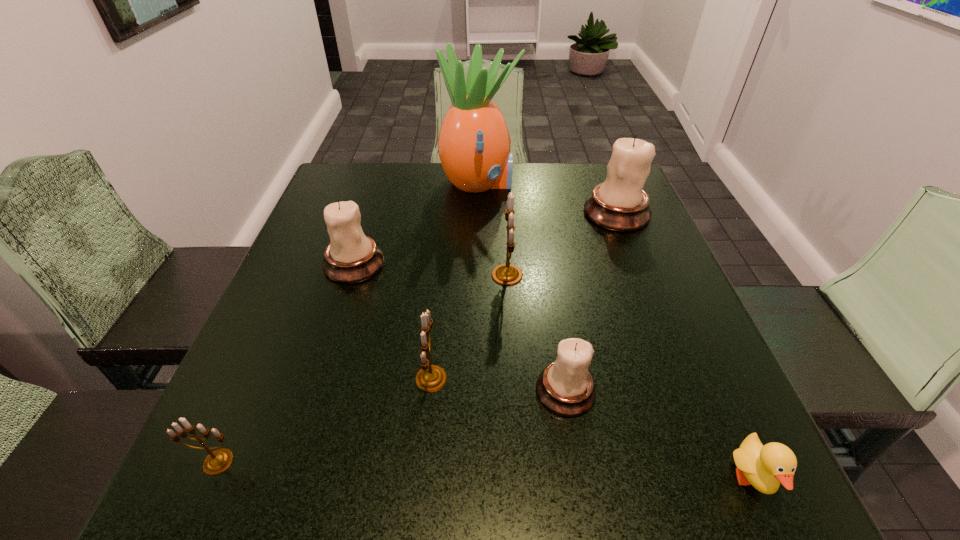
Locate an element on the screen. The height and width of the screenshot is (540, 960). vacant space located on the left of the second biggest gold candelabrum is located at coordinates (265, 379).

Locate an element on the screen. This screenshot has width=960, height=540. free spot located on the back of the nearest white candle holder is located at coordinates (553, 316).

Image resolution: width=960 pixels, height=540 pixels. Find the location of `vacant space located on the right of the nearest candelabrum`. vacant space located on the right of the nearest candelabrum is located at coordinates (465, 462).

Identify the location of pineapple that is at the far edge. (474, 144).

I want to click on candle holder located at the far edge, so pyautogui.click(x=620, y=204).

Image resolution: width=960 pixels, height=540 pixels. I want to click on candelabrum at the near edge, so click(218, 461).

The height and width of the screenshot is (540, 960). Identify the location of duckling that is at the near edge. tap(764, 467).

You are a GUI agent. You are given a task and a screenshot of the screen. Output one action in this format:
    pyautogui.click(x=<x>, y=<y>)
    Task: Click on the candle holder located at the right edge
    The height and width of the screenshot is (540, 960).
    Given the screenshot: What is the action you would take?
    pyautogui.click(x=620, y=204)

The width and height of the screenshot is (960, 540). What are the coordinates of `duckling located in the right edge section of the desktop` in the screenshot? It's located at (764, 467).

Identify the location of object that is at the near left corner. The image size is (960, 540). (218, 461).